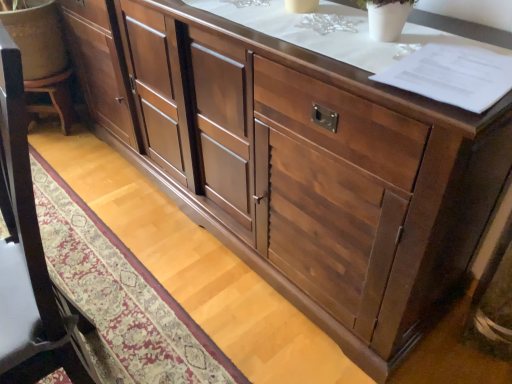
The width and height of the screenshot is (512, 384). Describe the element at coordinates (25, 251) in the screenshot. I see `wooden swivel chair at left` at that location.

Looking at this image, what is the approximate height of wooden swivel chair at left?

3.32 feet.

Locate an element on the screen. The image size is (512, 384). wooden swivel chair at left is located at coordinates (25, 251).

The image size is (512, 384). Find the location of `wooden swivel chair at left`. wooden swivel chair at left is located at coordinates (25, 251).